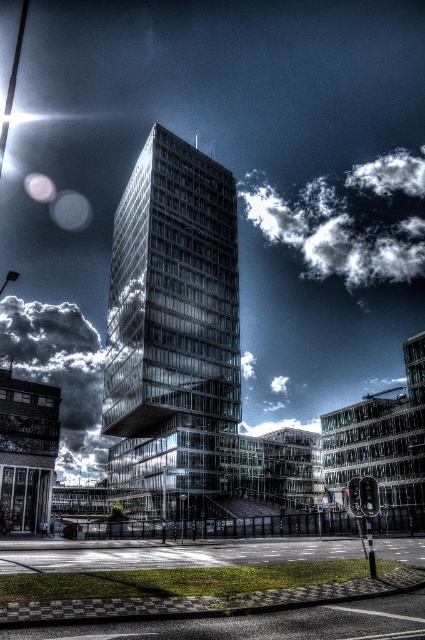
Question: Does transparent glass tower at center have a smaller size compared to cloudy sky at upper left?

Choices:
 (A) yes
 (B) no

Answer: (A)

Question: Can you confirm if transparent glass tower at center is positioned below cloudy sky at upper left?

Choices:
 (A) yes
 (B) no

Answer: (B)

Question: Among these points, which one is farthest from the camera?

Choices:
 (A) (306, 266)
 (B) (6, 337)

Answer: (B)

Question: Which of the following is the farthest from the observer?

Choices:
 (A) transparent glass tower at center
 (B) white fluffy cloud at upper right
 (C) cloudy sky at upper left

Answer: (B)

Question: Does white fluffy cloud at upper right have a greater width compared to cloudy sky at upper left?

Choices:
 (A) yes
 (B) no

Answer: (A)

Question: Which point is farther from the camera taking this photo?

Choices:
 (A) (348, 209)
 (B) (91, 385)

Answer: (A)